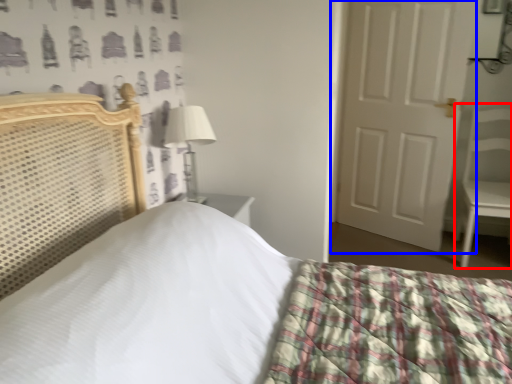
Question: Among these objects, which one is nearest to the camera, armchair (highlighted by a red box) or door (highlighted by a blue box)?

Choices:
 (A) armchair
 (B) door

Answer: (A)